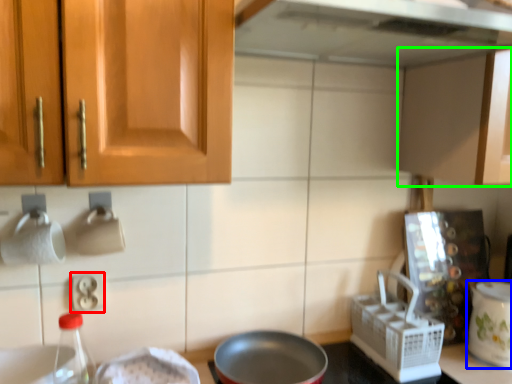
Question: Which is nearer to the electric outlet (highlighted by a red box)? kitchen appliance (highlighted by a blue box) or cabinetry (highlighted by a green box).

Choices:
 (A) kitchen appliance
 (B) cabinetry

Answer: (B)